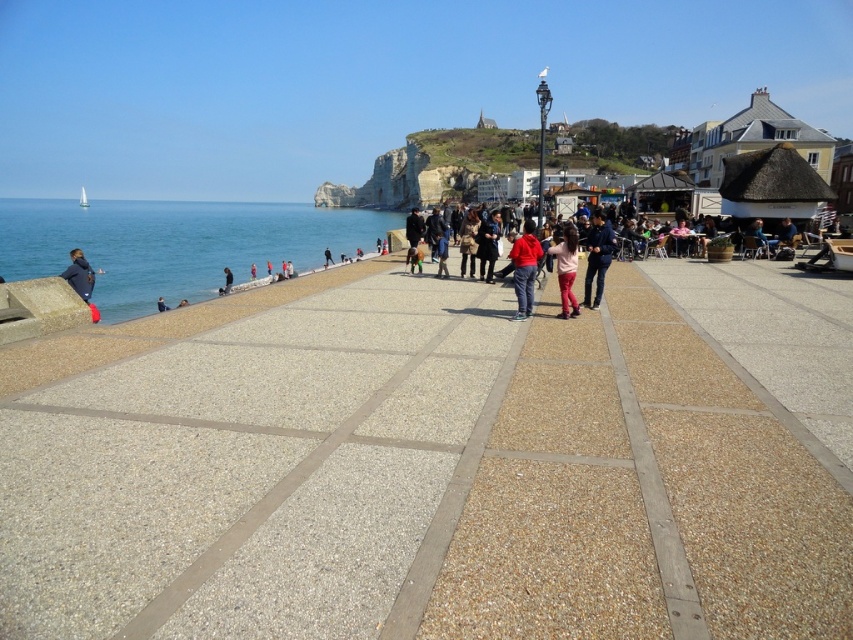
You are standing on the seaside promenade and see a person wearing pink fabric pants at center and a black fabric person at lower left. Which one is closer to you?

The pink fabric pants at center is closer to the viewer than the black fabric person at lower left.

You are standing on the seaside promenade and want to walk from point A to point B. Point A is located at the coordinates given by point [579,157] and point B is at point [567,268]. Which direction should you walk to move from point A to point B?

Since point [579,157] is closer to you than point [567,268], you should walk away from the ocean towards the horizon to reach point B from point A.

You are standing on the seaside promenade and want to take a photo of both the rocky cliff at upper center and the pink fabric pants at center. Which object should you focus on first to ensure both are in the frame?

You should focus on the rocky cliff at upper center first because it is closer to you than the pink fabric pants at center, ensuring both are in the frame.